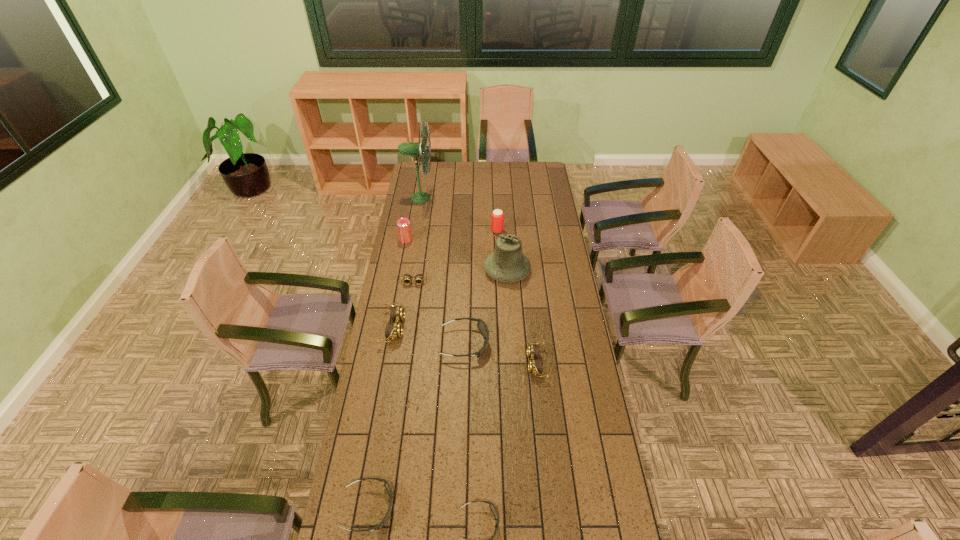
Locate an element on the screen. The width and height of the screenshot is (960, 540). the farthest object is located at coordinates (415, 149).

I want to click on the tallest object, so click(415, 149).

Image resolution: width=960 pixels, height=540 pixels. Find the location of `bell`. bell is located at coordinates (507, 264).

You are a GUI agent. You are given a task and a screenshot of the screen. Output one action in this format:
    pyautogui.click(x=<x>, y=<y>)
    Task: Click on the farther beer can
    The height and width of the screenshot is (540, 960).
    Given the screenshot: What is the action you would take?
    pyautogui.click(x=497, y=219)

The height and width of the screenshot is (540, 960). What are the coordinates of `the second farthest object` in the screenshot? It's located at (497, 219).

This screenshot has height=540, width=960. In order to click on the left beer can in this screenshot , I will do (403, 224).

Find the location of `the nearer beer can`. the nearer beer can is located at coordinates (403, 224).

The height and width of the screenshot is (540, 960). I want to click on the biggest brown goggles, so click(x=394, y=330).

This screenshot has height=540, width=960. I want to click on the sixth shortest object, so click(x=394, y=330).

Find the location of `the biggest black goggles`. the biggest black goggles is located at coordinates (481, 325).